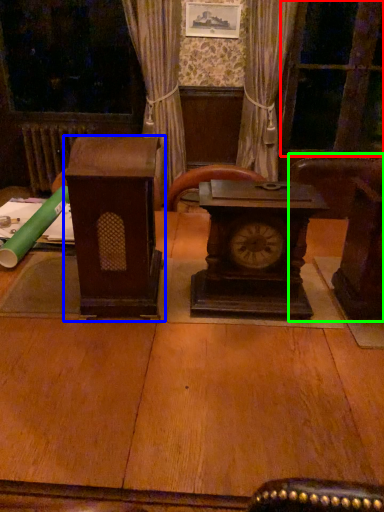
Question: Based on their relative distances, which object is farther from glass door (highlighted by a red box)? Choose from furniture (highlighted by a blue box) and furniture (highlighted by a green box).

Choices:
 (A) furniture
 (B) furniture

Answer: (A)